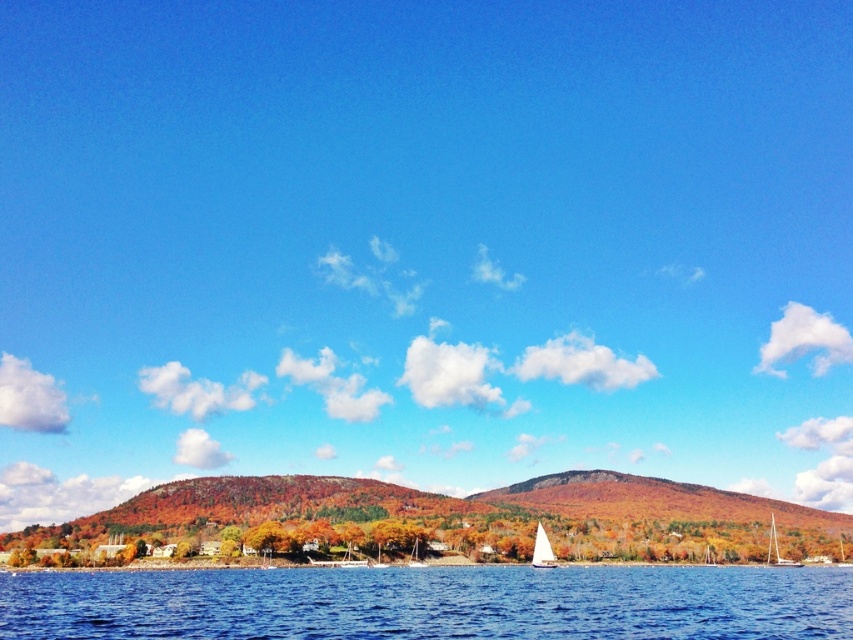
Question: Which point is farther from the camera taking this photo?

Choices:
 (A) (180, 589)
 (B) (769, 541)
 (C) (547, 557)

Answer: (B)

Question: Among these objects, which one is nearest to the camera?

Choices:
 (A) blue liquid water at lower center
 (B) white glossy sailboat at lower right
 (C) white glossy sailboat at center

Answer: (A)

Question: Estimate the real-world distances between objects in this image. Which object is farther from the white glossy sailboat at lower right?

Choices:
 (A) white sailboat at lower center
 (B) white glossy sailboat at center

Answer: (B)

Question: Can you confirm if white glossy sailboat at lower right is smaller than white glossy sailboat at center?

Choices:
 (A) yes
 (B) no

Answer: (B)

Question: Does blue liquid water at lower center have a smaller size compared to white sailboat at lower center?

Choices:
 (A) yes
 (B) no

Answer: (B)

Question: Considering the relative positions of blue liquid water at lower center and white glossy sailboat at center in the image provided, where is blue liquid water at lower center located with respect to white glossy sailboat at center?

Choices:
 (A) above
 (B) below

Answer: (A)